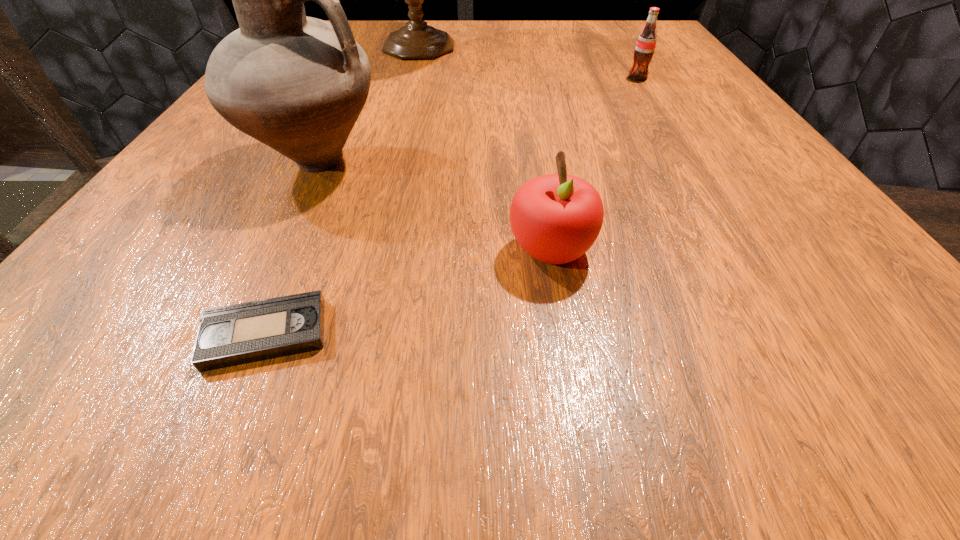
Where is `free location located 0.310m on the back of the soda`? The image size is (960, 540). free location located 0.310m on the back of the soda is located at coordinates (604, 23).

Locate an element on the screen. The image size is (960, 540). blank area located on the left of the apple is located at coordinates (278, 251).

Find the location of a particular element. This screenshot has width=960, height=540. vacant space located on the back of the shortest object is located at coordinates (352, 125).

Image resolution: width=960 pixels, height=540 pixels. What are the coordinates of `object that is at the far edge` in the screenshot? It's located at (417, 40).

Locate an element on the screen. This screenshot has width=960, height=540. object at the near edge is located at coordinates (236, 334).

The image size is (960, 540). I want to click on globe at the left edge, so click(x=417, y=40).

At what (x,y) coordinates should I click in order to perform the action: click on pitcher situated at the left edge. Please return your answer as a coordinate pair (x, y). The width and height of the screenshot is (960, 540). Looking at the image, I should click on (298, 84).

This screenshot has width=960, height=540. I want to click on videotape present at the left edge, so pos(236,334).

At what (x,y) coordinates should I click in order to perform the action: click on object at the right edge. Please return your answer as a coordinate pair (x, y). Looking at the image, I should click on (645, 46).

Locate an element on the screen. This screenshot has width=960, height=540. object present at the far left corner is located at coordinates (417, 40).